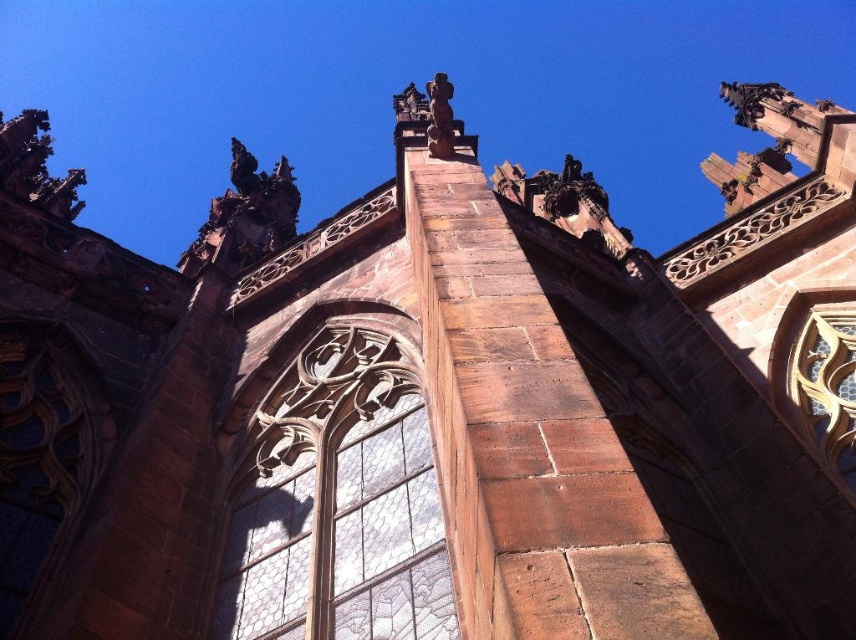
You are a maintenance worker needing to inspect two clear glass windows in a Gothic cathedral. The windows are the clear glass window at center and the clear glass window at upper right. Given that your ladder can extend up to 35 meters, can you safely reach both windows without needing a taller ladder?

The distance between the clear glass window at center and the clear glass window at upper right is 38.80 meters, which exceeds the ladder extension limit of 35 meters. Therefore, the ladder is too short to safely reach both windows.

You are standing in front of the Gothic cathedral and want to take a photo of the clear glass window at center. If your camera has a maximum focus range of 50 meters, will it be able to capture the window clearly?

The clear glass window at center is 52.67 meters away from the camera. Since the camera can only focus up to 50 meters, it will not be able to capture the window clearly.

You are standing in front of the Gothic structure and want to take a photo of the clear glass window at center. To ensure the window is centered in your photo, where should you aim your camera? Provide the coordinates as a point in the format of point followed by the coordinates in parentheses.

You should aim your camera at point (337, 502) to center the clear glass window at center in your photo.